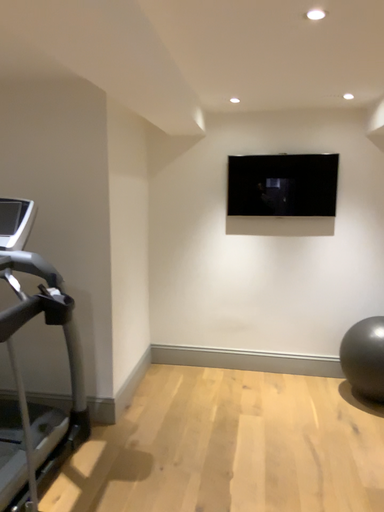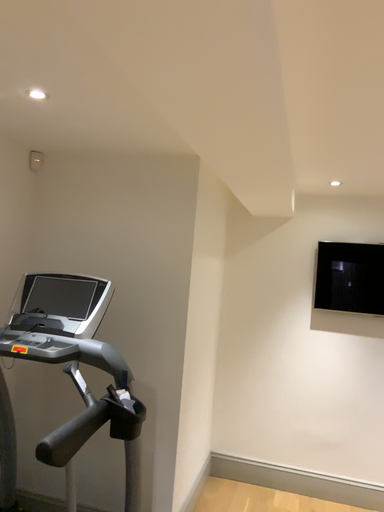
Question: Which way did the camera rotate in the video?

Choices:
 (A) rotated downward
 (B) rotated upward

Answer: (B)